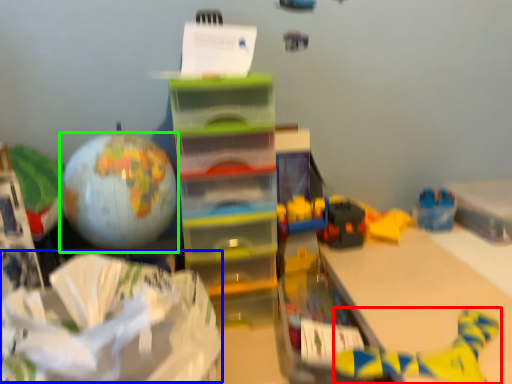
Question: Which object is positioned farthest from toy (highlighted by a red box)? Select from wrapping paper (highlighted by a blue box) and balloon (highlighted by a green box).

Choices:
 (A) wrapping paper
 (B) balloon

Answer: (B)